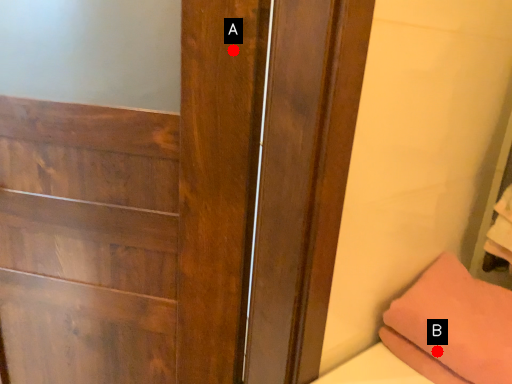
Question: Two points are circled on the image, labeled by A and B beside each circle. Which point is further to the camera?

Choices:
 (A) A is further
 (B) B is further

Answer: (B)